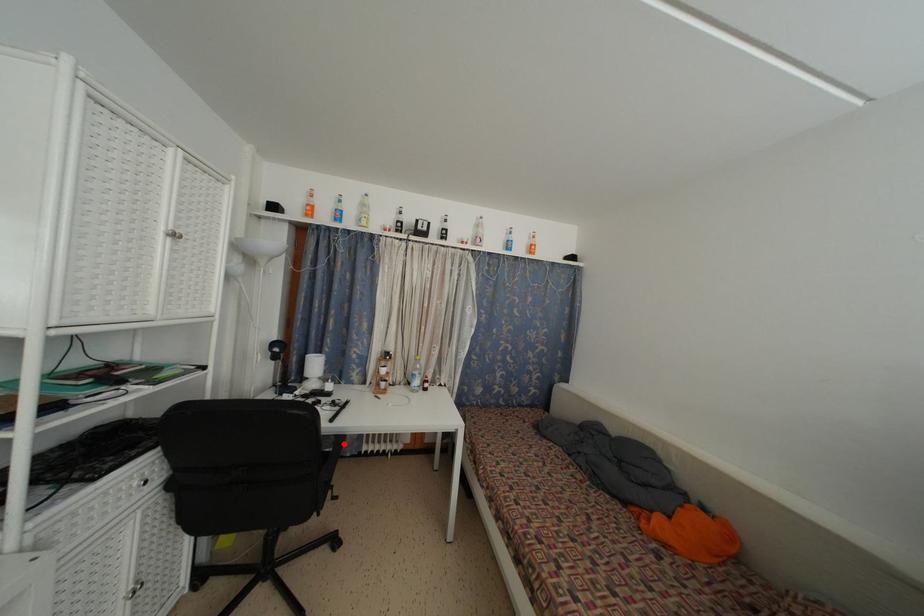
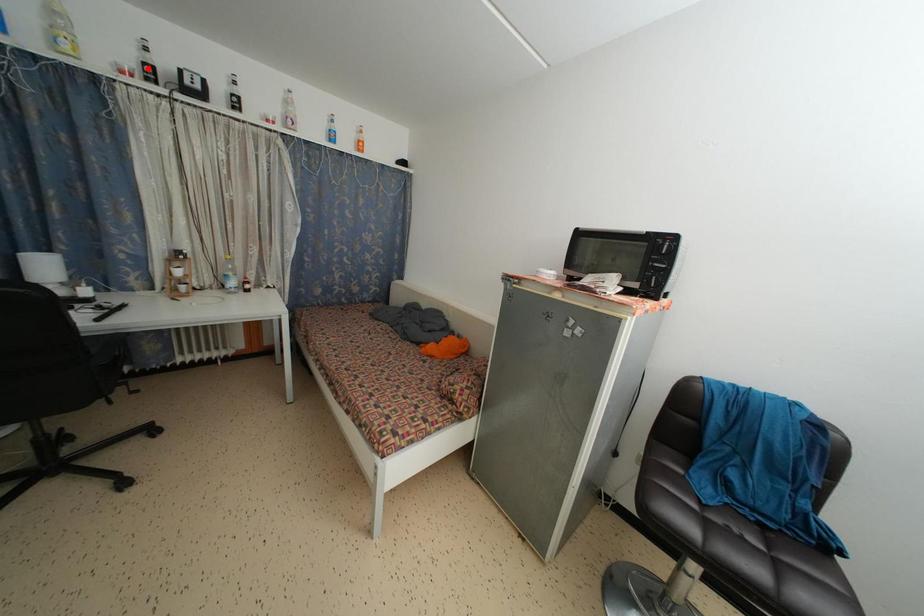
I am providing you with two images of the same scene from different viewpoints. A red point is marked on the first image and another point is marked on the second image. Is the red point in image1 aligned with the point shown in image2?

No